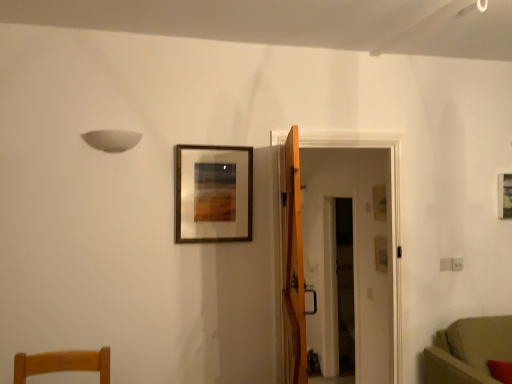
What do you see at coordinates (505, 196) in the screenshot? The width and height of the screenshot is (512, 384). I see `wooden picture frame at upper right, which is the 2th picture frame in back-to-front order` at bounding box center [505, 196].

What do you see at coordinates (293, 262) in the screenshot? I see `wooden door at center` at bounding box center [293, 262].

This screenshot has width=512, height=384. In order to click on wooden-framed artwork at center, acting as the first picture frame starting from the left in this screenshot , I will do `click(213, 193)`.

Locate an element on the screen. The width and height of the screenshot is (512, 384). transparent glass door at center is located at coordinates (336, 283).

At what (x,y) coordinates should I click in order to perform the action: click on wooden picture frame at upper right, acting as the first picture frame starting from the right. Please return your answer as a coordinate pair (x, y). This screenshot has width=512, height=384. Looking at the image, I should click on (505, 196).

From the image's perspective, who appears lower, suede-like beige sofa at lower right or matte gold picture frame at upper right, the second picture frame viewed from the right?

suede-like beige sofa at lower right is shown below in the image.

Is suede-like beige sofa at lower right touching matte gold picture frame at upper right, the second picture frame viewed from the right?

suede-like beige sofa at lower right and matte gold picture frame at upper right, the second picture frame viewed from the right, are clearly separated.

The image size is (512, 384). Find the location of `the 1st picture frame positioned above the suede-like beige sofa at lower right (from the image's perspective)`. the 1st picture frame positioned above the suede-like beige sofa at lower right (from the image's perspective) is located at coordinates click(x=380, y=202).

Does suede-like beige sofa at lower right have a lesser width compared to matte gold picture frame at upper right, the second picture frame viewed from the right?

In fact, suede-like beige sofa at lower right might be wider than matte gold picture frame at upper right, the second picture frame viewed from the right.

From a real-world perspective, which object rests below the other?

wooden door at center, from a real-world perspective.

Is wooden door at center in front of wooden picture frame at upper right, which ranks as the 3th picture frame in left-to-right order?

Yes.

Is wooden door at center beside wooden picture frame at upper right, which is the 2th picture frame in back-to-front order?

No, wooden door at center is not beside wooden picture frame at upper right, which is the 2th picture frame in back-to-front order.

Who is smaller, wooden door at center or wooden picture frame at upper right, the 2th picture frame when ordered from front to back?

With smaller size is wooden picture frame at upper right, the 2th picture frame when ordered from front to back.

Would you say suede-like beige sofa at lower right contains wooden door at center?

No, wooden door at center is not a part of suede-like beige sofa at lower right.

Is the surface of suede-like beige sofa at lower right in direct contact with wooden door at center?

No.

Can you confirm if wooden-framed artwork at center, placed as the third picture frame when sorted from back to front, is taller than matte gold picture frame at upper right, which is counted as the first picture frame, starting from the back?

Yes.

From the image's perspective, is wooden-framed artwork at center, acting as the first picture frame starting from the left, located beneath matte gold picture frame at upper right, placed as the third picture frame when sorted from front to back?

Actually, wooden-framed artwork at center, acting as the first picture frame starting from the left, appears above matte gold picture frame at upper right, placed as the third picture frame when sorted from front to back, in the image.

Between wooden-framed artwork at center, which is counted as the third picture frame, starting from the right, and matte gold picture frame at upper right, the second picture frame positioned from the left, which one is positioned in front?

Positioned in front is wooden-framed artwork at center, which is counted as the third picture frame, starting from the right.

In the image, is matte gold picture frame at upper right, the second picture frame positioned from the left, on the left side or the right side of wooden picture frame at upper right, acting as the first picture frame starting from the right?

From the image, it's evident that matte gold picture frame at upper right, the second picture frame positioned from the left, is to the left of wooden picture frame at upper right, acting as the first picture frame starting from the right.

From the image's perspective, is matte gold picture frame at upper right, placed as the third picture frame when sorted from front to back, located beneath wooden picture frame at upper right, which is the 2th picture frame in back-to-front order?

Correct, matte gold picture frame at upper right, placed as the third picture frame when sorted from front to back, appears lower than wooden picture frame at upper right, which is the 2th picture frame in back-to-front order, in the image.

How far apart are matte gold picture frame at upper right, the second picture frame viewed from the right, and wooden picture frame at upper right, acting as the first picture frame starting from the right?

31.33 inches.

The width and height of the screenshot is (512, 384). What are the coordinates of `picture frame on the right of matte gold picture frame at upper right, the second picture frame positioned from the left` in the screenshot? It's located at (505, 196).

From the image's perspective, which is below, wooden picture frame at upper right, which is the 2th picture frame in back-to-front order, or wooden door at center?

wooden door at center is shown below in the image.

Which object is positioned more to the right, wooden picture frame at upper right, which is the 2th picture frame in back-to-front order, or wooden door at center?

wooden picture frame at upper right, which is the 2th picture frame in back-to-front order.

Is wooden picture frame at upper right, which ranks as the 3th picture frame in left-to-right order, closer to the viewer compared to wooden door at center?

That is False.

Is point (509, 181) less distant than point (292, 156)?

No, (509, 181) is further to viewer.

Does wooden door at center have a smaller size compared to wooden-framed artwork at center, acting as the first picture frame starting from the left?

Actually, wooden door at center might be larger than wooden-framed artwork at center, acting as the first picture frame starting from the left.

In the scene shown: Measure the distance between wooden door at center and wooden-framed artwork at center, the 1th picture frame viewed from the front.

41.42 centimeters.

You are a GUI agent. You are given a task and a screenshot of the screen. Output one action in this format:
    pyautogui.click(x=<x>, y=<y>)
    Task: Click on the 3rd picture frame above the wooden door at center (from the image's perspective)
    The width and height of the screenshot is (512, 384).
    Given the screenshot: What is the action you would take?
    pyautogui.click(x=213, y=193)

Considering the relative positions of wooden door at center and wooden-framed artwork at center, acting as the first picture frame starting from the left, in the image provided, is wooden door at center to the right of wooden-framed artwork at center, acting as the first picture frame starting from the left, from the viewer's perspective?

Correct, you'll find wooden door at center to the right of wooden-framed artwork at center, acting as the first picture frame starting from the left.

At what (x,y) coordinates should I click in order to perform the action: click on furniture below the matte gold picture frame at upper right, the second picture frame viewed from the right (from a real-world perspective). Please return your answer as a coordinate pair (x, y). Looking at the image, I should click on (468, 351).

Where is `door on the left of wooden picture frame at upper right, which is the 2th picture frame in back-to-front order`? The image size is (512, 384). door on the left of wooden picture frame at upper right, which is the 2th picture frame in back-to-front order is located at coordinates (293, 262).

Based on their spatial positions, is suede-like beige sofa at lower right or wooden-framed artwork at center, placed as the third picture frame when sorted from back to front, closer to transparent glass door at center?

The object closer to transparent glass door at center is suede-like beige sofa at lower right.

Looking at the image, which one is located further to suede-like beige sofa at lower right, wooden door at center or matte gold picture frame at upper right, the second picture frame viewed from the right?

Result: wooden door at center.

Based on their spatial positions, is matte gold picture frame at upper right, the second picture frame viewed from the right, or transparent glass door at center closer to wooden picture frame at upper right, the 2th picture frame when ordered from front to back?

matte gold picture frame at upper right, the second picture frame viewed from the right, is closer to wooden picture frame at upper right, the 2th picture frame when ordered from front to back.

Which object lies nearer to the anchor point wooden door at center, wooden picture frame at upper right, acting as the first picture frame starting from the right, or transparent glass door at center?

wooden picture frame at upper right, acting as the first picture frame starting from the right, is positioned closer to the anchor wooden door at center.

Based on the photo, estimate the real-world distances between objects in this image. Which object is closer to matte gold picture frame at upper right, the second picture frame viewed from the right, transparent glass door at center or wooden door at center?

Based on the image, wooden door at center appears to be nearer to matte gold picture frame at upper right, the second picture frame viewed from the right.

Looking at the image, which one is located further to matte gold picture frame at upper right, the second picture frame positioned from the left, wooden picture frame at upper right, which is the 2th picture frame in back-to-front order, or suede-like beige sofa at lower right?

suede-like beige sofa at lower right is further to matte gold picture frame at upper right, the second picture frame positioned from the left.

Based on their spatial positions, is transparent glass door at center or suede-like beige sofa at lower right further from wooden picture frame at upper right, acting as the first picture frame starting from the right?

The object further to wooden picture frame at upper right, acting as the first picture frame starting from the right, is transparent glass door at center.

When comparing their distances from transparent glass door at center, does wooden-framed artwork at center, acting as the first picture frame starting from the left, or wooden picture frame at upper right, the 2th picture frame when ordered from front to back, seem further?

Based on the image, wooden-framed artwork at center, acting as the first picture frame starting from the left, appears to be further to transparent glass door at center.

You are a GUI agent. You are given a task and a screenshot of the screen. Output one action in this format:
    pyautogui.click(x=<x>, y=<y>)
    Task: Click on the furniture positioned between wooden door at center and matte gold picture frame at upper right, placed as the third picture frame when sorted from front to back, from near to far
    This screenshot has height=384, width=512.
    Given the screenshot: What is the action you would take?
    pyautogui.click(x=468, y=351)

This screenshot has width=512, height=384. I want to click on picture frame between wooden-framed artwork at center, which is counted as the third picture frame, starting from the right, and suede-like beige sofa at lower right, in the horizontal direction, so click(380, 202).

You are a GUI agent. You are given a task and a screenshot of the screen. Output one action in this format:
    pyautogui.click(x=<x>, y=<y>)
    Task: Click on the glass door between wooden-framed artwork at center, which is counted as the third picture frame, starting from the right, and suede-like beige sofa at lower right from left to right
    
    Given the screenshot: What is the action you would take?
    pyautogui.click(x=336, y=283)

This screenshot has height=384, width=512. Find the location of `furniture located between wooden-framed artwork at center, placed as the third picture frame when sorted from back to front, and wooden picture frame at upper right, which is the 2th picture frame in back-to-front order, in the left-right direction`. furniture located between wooden-framed artwork at center, placed as the third picture frame when sorted from back to front, and wooden picture frame at upper right, which is the 2th picture frame in back-to-front order, in the left-right direction is located at coordinates (468, 351).